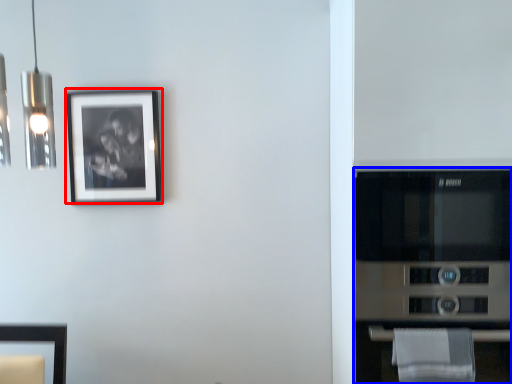
Question: Which point is further to the camera, picture frame (highlighted by a red box) or appliance (highlighted by a blue box)?

Choices:
 (A) picture frame
 (B) appliance

Answer: (A)